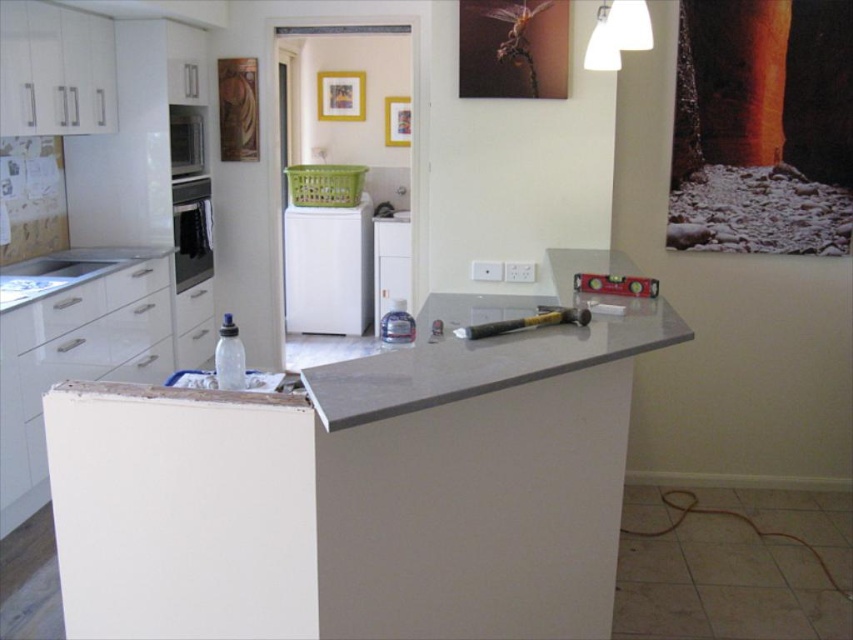
Question: Which point appears closest to the camera in this image?

Choices:
 (A) (630, 26)
 (B) (393, 145)
 (C) (326, 77)

Answer: (A)

Question: Estimate the real-world distances between objects in this image. Which object is closer to the white glossy sink at left?

Choices:
 (A) wooden picture frame at center
 (B) white matte dishwasher at center

Answer: (B)

Question: Considering the real-world distances, which object is farthest from the white glossy lampshade at upper center?

Choices:
 (A) matte gold picture frame at upper center
 (B) white glossy sink at left

Answer: (A)

Question: Is white glossy lampshade at upper center below white plastic dishwasher at center?

Choices:
 (A) yes
 (B) no

Answer: (B)

Question: Does white matte dishwasher at center appear under matte gold picture frame at upper center?

Choices:
 (A) no
 (B) yes

Answer: (B)

Question: Does satin black oven at left have a smaller size compared to wooden picture frame at center?

Choices:
 (A) yes
 (B) no

Answer: (B)